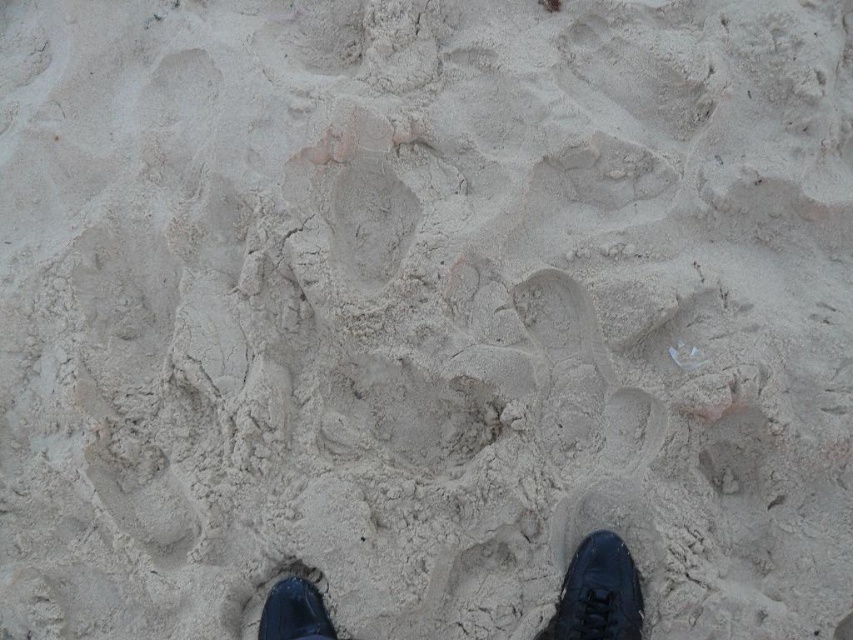
Can you confirm if black leather shoes at lower center is positioned below black leather shoe at lower right?

No.

Looking at this image, which is more to the right, black leather shoes at lower center or black leather shoe at lower right?

Positioned to the right is black leather shoes at lower center.

This screenshot has width=853, height=640. What are the coordinates of `black leather shoes at lower center` in the screenshot? It's located at (598, 593).

Does point (618, 566) come farther from viewer compared to point (267, 612)?

No.

Can you confirm if black leather shoe at lower right is smaller than black leather shoe at lower left?

No, black leather shoe at lower right is not smaller than black leather shoe at lower left.

Is point (561, 582) farther from viewer compared to point (277, 628)?

Yes, point (561, 582) is behind point (277, 628).

Identify the location of black leather shoe at lower right. (598, 593).

Does black leather shoes at lower center have a larger size compared to black leather shoe at lower left?

Yes, black leather shoes at lower center is bigger than black leather shoe at lower left.

In the scene shown: Is black leather shoes at lower center to the right of black leather shoe at lower left from the viewer's perspective?

Correct, you'll find black leather shoes at lower center to the right of black leather shoe at lower left.

Is point (633, 637) farther from viewer compared to point (311, 593)?

No.

Locate an element on the screen. The image size is (853, 640). black leather shoes at lower center is located at coordinates (598, 593).